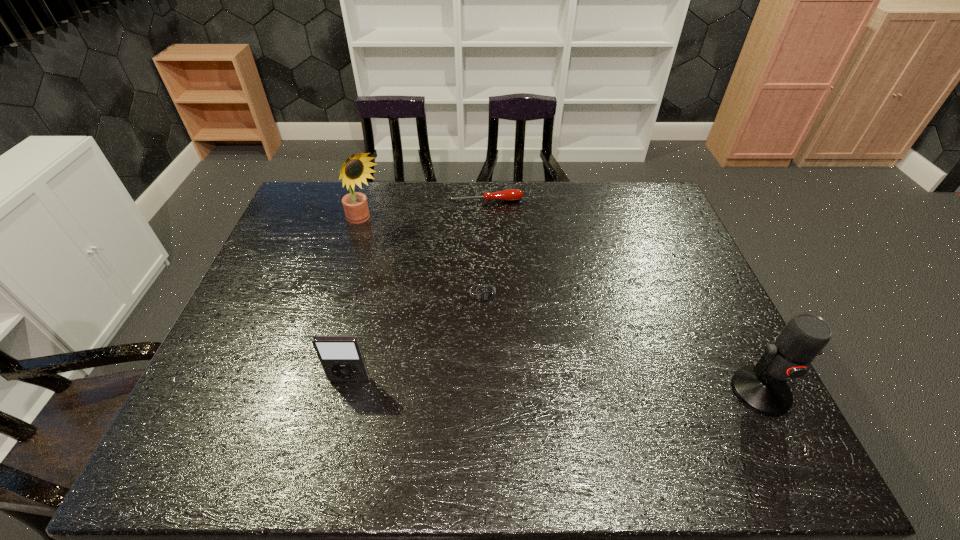
You are a GUI agent. You are given a task and a screenshot of the screen. Output one action in this format:
    pyautogui.click(x=<x>, y=<y>)
    Task: Click on the vacant position located 0.180m at the tip of the second shortest object
    The width and height of the screenshot is (960, 540).
    Given the screenshot: What is the action you would take?
    pyautogui.click(x=495, y=238)

You are a GUI agent. You are given a task and a screenshot of the screen. Output one action in this format:
    pyautogui.click(x=<x>, y=<y>)
    Task: Click on the blank area located on the face of the shortest object
    
    Given the screenshot: What is the action you would take?
    pyautogui.click(x=496, y=335)

Identify the location of vacant space situated 0.140m on the face of the shortest object. Image resolution: width=960 pixels, height=540 pixels. (502, 354).

Locate an element on the screen. The image size is (960, 540). vacant space situated on the face of the shortest object is located at coordinates (509, 379).

Where is `vacant space located on the face of the fourth nearest object`? The image size is (960, 540). vacant space located on the face of the fourth nearest object is located at coordinates (x=405, y=254).

Find the location of `free location located on the face of the fourth nearest object`. free location located on the face of the fourth nearest object is located at coordinates (424, 269).

Where is `vacant space located on the face of the fourth nearest object`? The height and width of the screenshot is (540, 960). vacant space located on the face of the fourth nearest object is located at coordinates (451, 292).

I want to click on screwdriver that is at the far edge, so click(x=511, y=194).

This screenshot has width=960, height=540. Find the location of `sunflower at the far edge`. sunflower at the far edge is located at coordinates (355, 170).

The width and height of the screenshot is (960, 540). What are the coordinates of `iPod present at the near edge` in the screenshot? It's located at (342, 359).